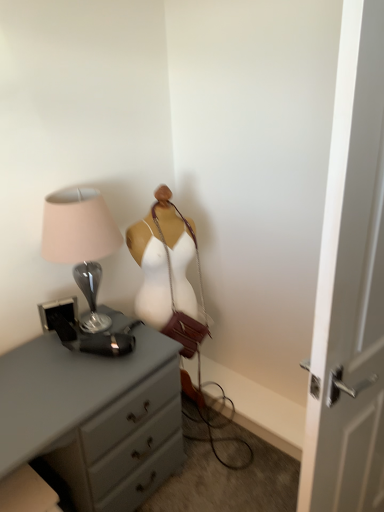
The image size is (384, 512). Find the location of `vacant area located to the right-hand side of white fabric mannequin at center`. vacant area located to the right-hand side of white fabric mannequin at center is located at coordinates (216, 434).